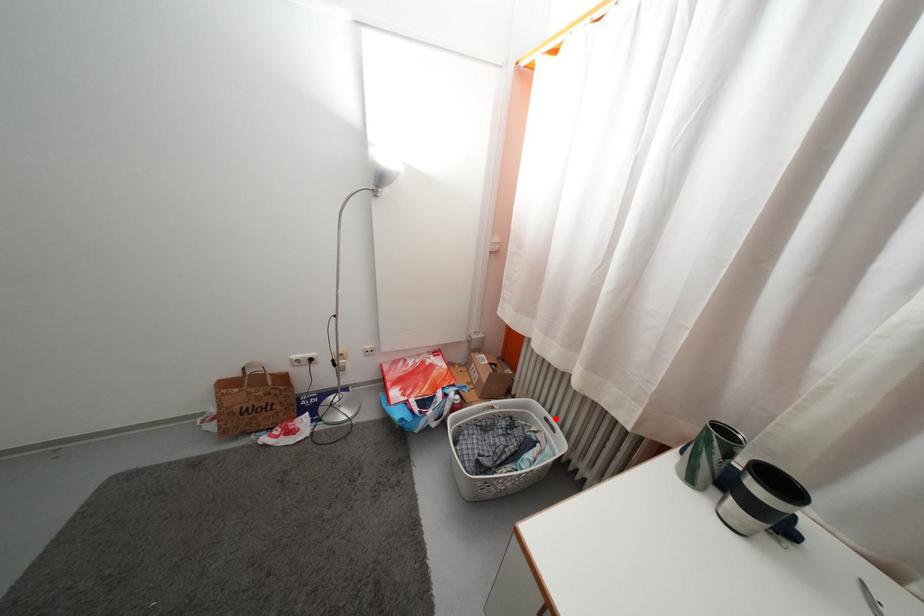
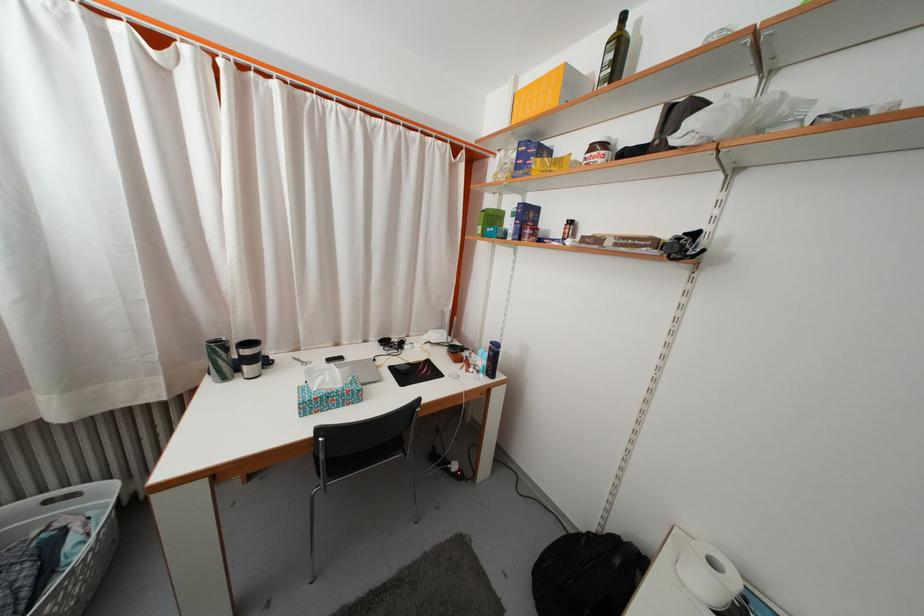
Find the pixel in the second image that matches the highlighted location in the first image.

(49, 498)